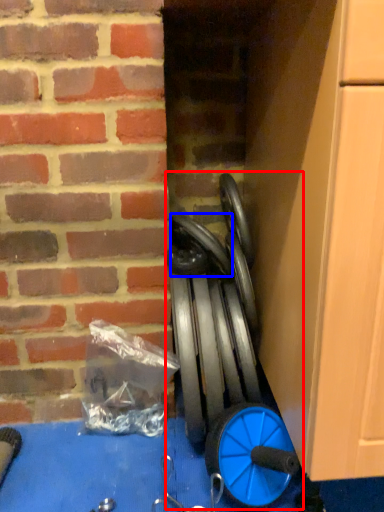
Question: Which of the following is the closest to the observer, sport equipment (highlighted by a red box) or car tire (highlighted by a blue box)?

Choices:
 (A) sport equipment
 (B) car tire

Answer: (A)